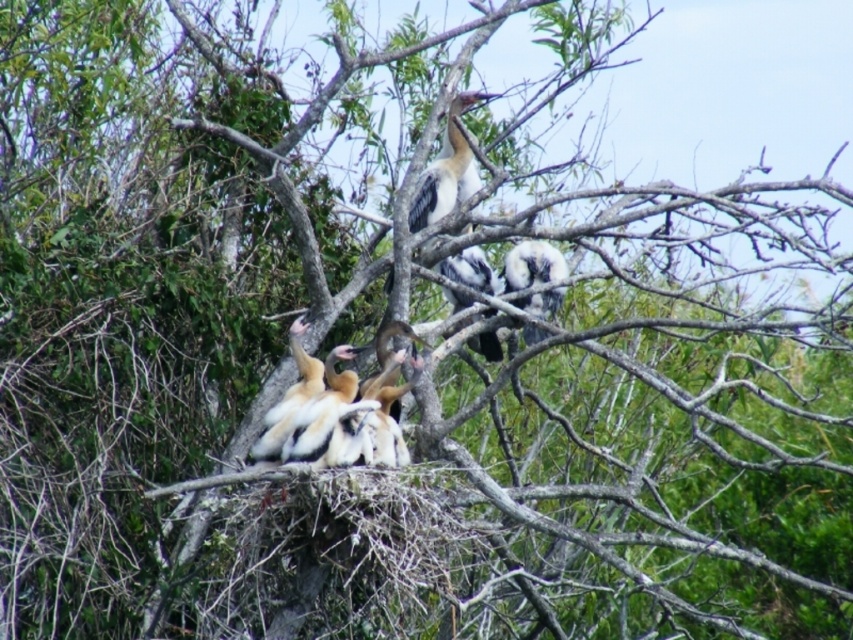
Between white fluffy feathers at center and white fluffy feathers at upper center, which one appears on the right side from the viewer's perspective?

white fluffy feathers at upper center is more to the right.

Between white fluffy feathers at center and white fluffy feathers at upper center, which one has less height?

Standing shorter between the two is white fluffy feathers at upper center.

This screenshot has width=853, height=640. I want to click on white fluffy feathers at center, so click(x=297, y=396).

This screenshot has width=853, height=640. I want to click on white fluffy feathers at center, so click(297, 396).